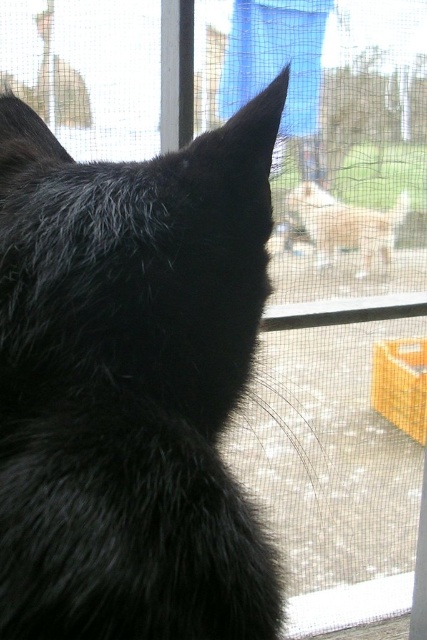
Question: Which of the following is the closest to the observer?

Choices:
 (A) (11, 612)
 (B) (357, 600)

Answer: (A)

Question: Which point is farther from the camera taking this photo?

Choices:
 (A) (336, 205)
 (B) (315, 593)

Answer: (B)

Question: Which object appears farthest from the camera in this image?

Choices:
 (A) black fluffy cat at left
 (B) screen mesh at upper center
 (C) fuzzy beige dog at center

Answer: (C)

Question: Is black fluffy cat at left below white mesh screen at lower center?

Choices:
 (A) yes
 (B) no

Answer: (B)

Question: Can you confirm if black fluffy cat at left is positioned to the right of fuzzy beige dog at center?

Choices:
 (A) no
 (B) yes

Answer: (A)

Question: Does black fluffy cat at left come behind fuzzy beige dog at center?

Choices:
 (A) no
 (B) yes

Answer: (A)